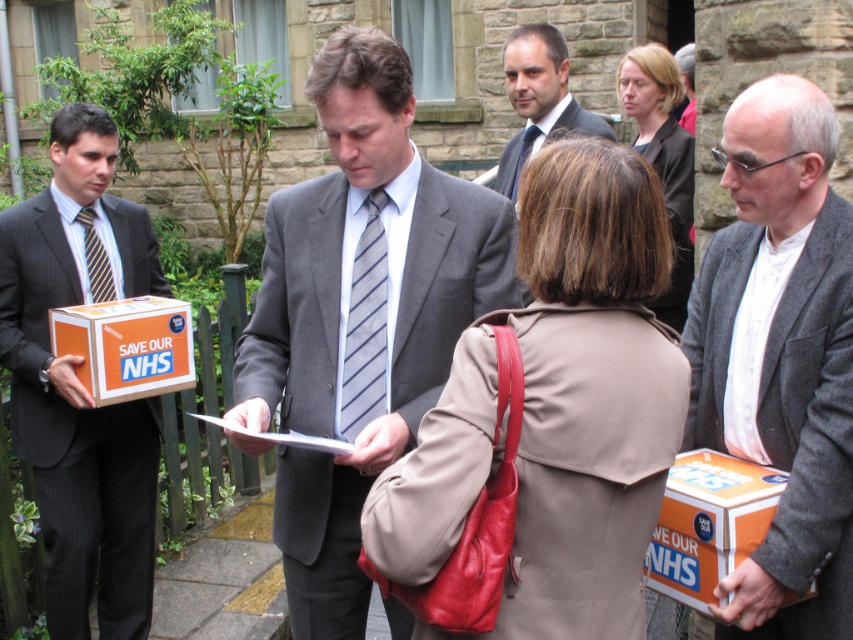
Question: Among these objects, which one is farthest from the camera?

Choices:
 (A) gray suit at center
 (B) matte gray suit at center
 (C) matte black coat at center

Answer: (C)

Question: Which point appears closest to the camera in this image?

Choices:
 (A) (527, 150)
 (B) (424, 456)

Answer: (B)

Question: In this image, where is gray wool coat at right located relative to matte gray tie at center?

Choices:
 (A) below
 (B) above

Answer: (A)

Question: Can you confirm if gray wool coat at right is positioned to the right of matte gray suit at center?

Choices:
 (A) yes
 (B) no

Answer: (A)

Question: Which object is positioned farthest from the orange cardboard box at left?

Choices:
 (A) matte black suit at left
 (B) matte gray tie at center
 (C) beige leather coat at center

Answer: (C)

Question: Is the position of gray wool coat at right more distant than that of matte black coat at center?

Choices:
 (A) no
 (B) yes

Answer: (A)